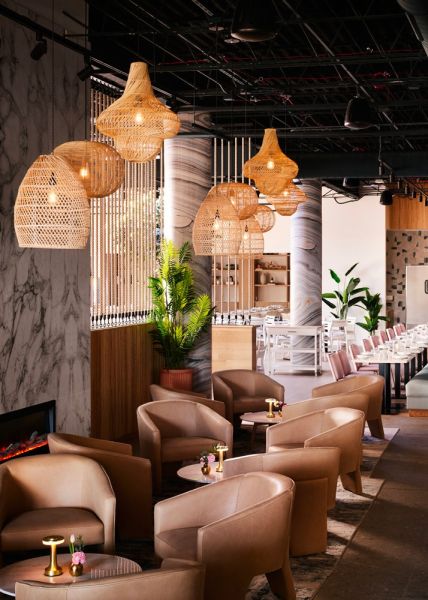
Where is `plant`? The width and height of the screenshot is (428, 600). plant is located at coordinates (368, 322).